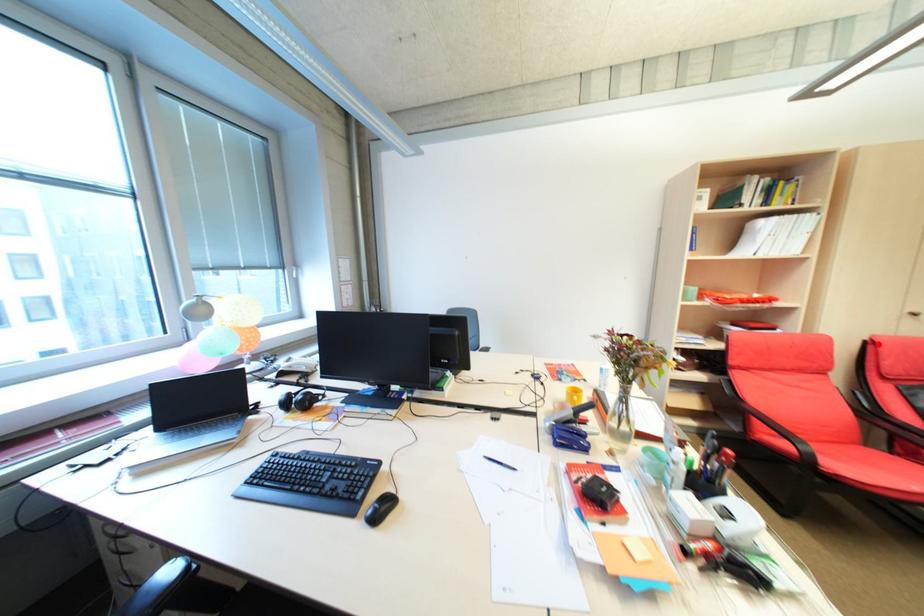
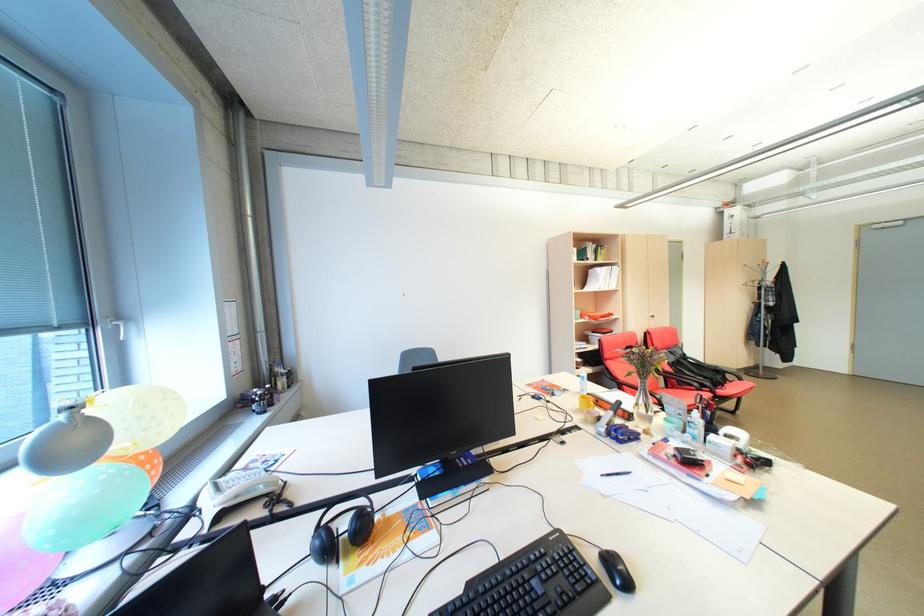
Find the pixel in the second image that matches the highlighted location in the first image.

(655, 334)